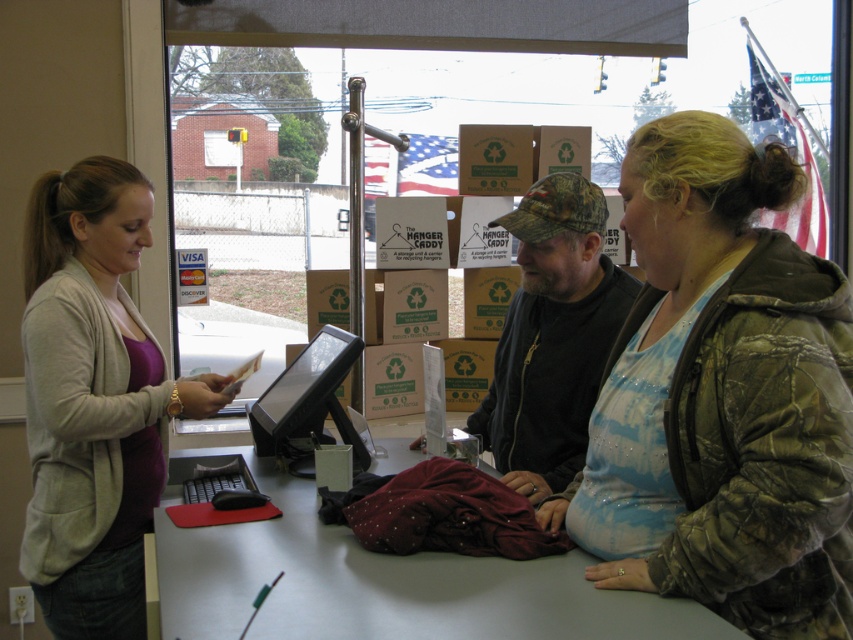
Is point (845, 577) farther from camera compared to point (38, 236)?

No, (845, 577) is in front of (38, 236).

In the scene shown: Can you confirm if camo jacket at center is taller than light gray cardigan at left?

No.

I want to click on camo jacket at center, so click(x=722, y=396).

Where is `camo jacket at center`? The image size is (853, 640). camo jacket at center is located at coordinates (722, 396).

Can you confirm if camo jacket at center is thinner than camouflage hat at center?

Yes, camo jacket at center is thinner than camouflage hat at center.

Is camo jacket at center below camouflage hat at center?

Result: Yes.

Describe the element at coordinates (722, 396) in the screenshot. I see `camo jacket at center` at that location.

This screenshot has height=640, width=853. I want to click on camo jacket at center, so click(x=722, y=396).

Is point (61, 412) positioned in front of point (582, 209)?

Yes, it is.

Can you confirm if light gray cardigan at left is taller than camouflage hat at center?

Indeed, light gray cardigan at left has a greater height compared to camouflage hat at center.

Find the location of a particular element. The image size is (853, 640). light gray cardigan at left is located at coordinates (94, 401).

Identify the location of light gray cardigan at left. The width and height of the screenshot is (853, 640). (94, 401).